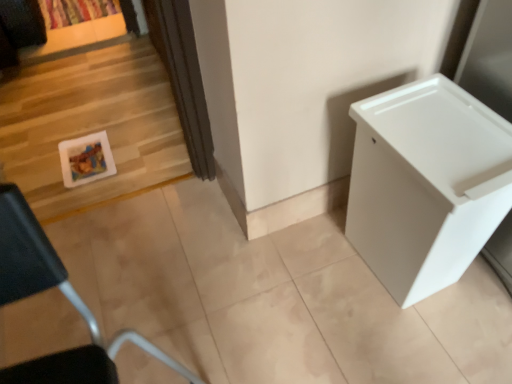
Question: Relative to white plastic container at lower left, is multicolored fabric curtain at upper left in front or behind?

Choices:
 (A) behind
 (B) front

Answer: (A)

Question: From a real-world perspective, is multicolored fabric curtain at upper left positioned above or below white plastic container at lower left?

Choices:
 (A) above
 (B) below

Answer: (B)

Question: Which of these objects is positioned farthest from the white plastic container at lower left?

Choices:
 (A) white plastic changing table at right
 (B) multicolored fabric curtain at upper left
 (C) white glossy picture frame at left

Answer: (B)

Question: Considering the real-world distances, which object is closest to the white plastic changing table at right?

Choices:
 (A) white plastic container at lower left
 (B) white glossy picture frame at left
 (C) multicolored fabric curtain at upper left

Answer: (A)